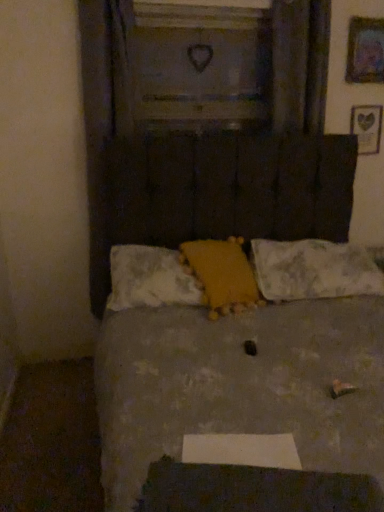
Question: Is the position of yellow fabric pillow at center, which is counted as the first pillow, starting from the left, less distant than that of textured gray bed at center?

Choices:
 (A) no
 (B) yes

Answer: (A)

Question: Can you confirm if yellow fabric pillow at center, which is counted as the third pillow, starting from the right, is positioned to the right of textured gray bed at center?

Choices:
 (A) yes
 (B) no

Answer: (B)

Question: Is yellow fabric pillow at center, which is counted as the first pillow, starting from the left, not within textured gray bed at center?

Choices:
 (A) yes
 (B) no

Answer: (B)

Question: Considering the relative positions of yellow fabric pillow at center, which is counted as the first pillow, starting from the left, and textured gray bed at center in the image provided, is yellow fabric pillow at center, which is counted as the first pillow, starting from the left, behind textured gray bed at center?

Choices:
 (A) no
 (B) yes

Answer: (B)

Question: Can you confirm if yellow fabric pillow at center, which is counted as the first pillow, starting from the left, is bigger than textured gray bed at center?

Choices:
 (A) no
 (B) yes

Answer: (A)

Question: Considering the positions of wooden heart at upper right, the 2th picture frame from the front, and yellow plush at center, which ranks as the 2th pillow in right-to-left order, in the image, is wooden heart at upper right, the 2th picture frame from the front, wider or thinner than yellow plush at center, which ranks as the 2th pillow in right-to-left order,?

Choices:
 (A) thin
 (B) wide

Answer: (A)

Question: Is point (359, 106) positioned closer to the camera than point (249, 266)?

Choices:
 (A) farther
 (B) closer

Answer: (A)

Question: Considering their positions, is wooden heart at upper right, the 2th picture frame from the front, located in front of or behind yellow plush at center, which ranks as the 2th pillow in right-to-left order?

Choices:
 (A) front
 (B) behind

Answer: (B)

Question: From a real-world perspective, is wooden heart at upper right, positioned as the second picture frame in top-to-bottom order, positioned above or below yellow plush at center, acting as the second pillow starting from the left?

Choices:
 (A) above
 (B) below

Answer: (A)

Question: In the image, is textured gray bed at center positioned in front of or behind yellow plush at center, which ranks as the 2th pillow in right-to-left order?

Choices:
 (A) front
 (B) behind

Answer: (A)

Question: Does point (135, 189) appear closer or farther from the camera than point (238, 246)?

Choices:
 (A) farther
 (B) closer

Answer: (B)

Question: From the image's perspective, relative to yellow plush at center, which ranks as the 2th pillow in right-to-left order, is textured gray bed at center above or below?

Choices:
 (A) above
 (B) below

Answer: (B)

Question: Considering the positions of textured gray bed at center and yellow plush at center, which ranks as the 2th pillow in right-to-left order, in the image, is textured gray bed at center bigger or smaller than yellow plush at center, which ranks as the 2th pillow in right-to-left order,?

Choices:
 (A) big
 (B) small

Answer: (A)

Question: In terms of size, does yellow plush at center, which ranks as the 2th pillow in right-to-left order, appear bigger or smaller than wooden heart at upper right, the 1th picture frame in the bottom-to-top sequence?

Choices:
 (A) big
 (B) small

Answer: (A)

Question: From the image's perspective, is yellow plush at center, which ranks as the 2th pillow in right-to-left order, located above or below wooden heart at upper right, the 1th picture frame in the back-to-front sequence?

Choices:
 (A) above
 (B) below

Answer: (B)